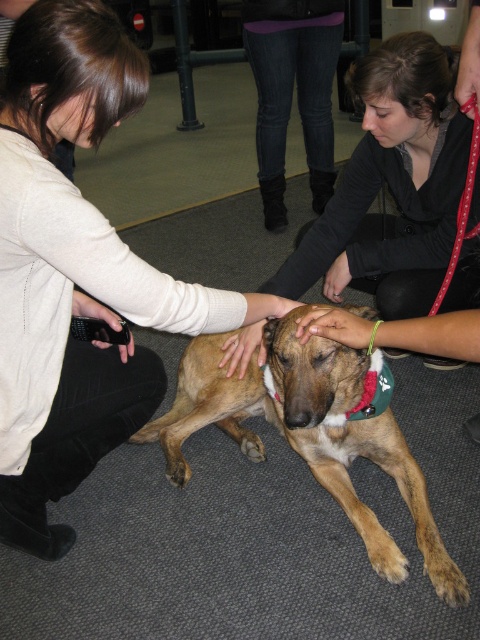
Question: Among these points, which one is nearest to the camera?

Choices:
 (A) (88, 84)
 (B) (452, 605)

Answer: (A)

Question: Which point is closer to the camera?

Choices:
 (A) matte beige sweater at center
 (B) matte black shirt at center
 (C) brown furry dog at center

Answer: (A)

Question: Is matte beige sweater at center smaller than brown furry dog at center?

Choices:
 (A) yes
 (B) no

Answer: (B)

Question: Which of these objects is positioned farthest from the matte beige sweater at center?

Choices:
 (A) matte black shirt at center
 (B) brown furry dog at center

Answer: (A)

Question: Observing the image, what is the correct spatial positioning of matte beige sweater at center in reference to matte black shirt at center?

Choices:
 (A) below
 (B) above

Answer: (A)

Question: Is matte beige sweater at center wider than brown furry dog at center?

Choices:
 (A) yes
 (B) no

Answer: (B)